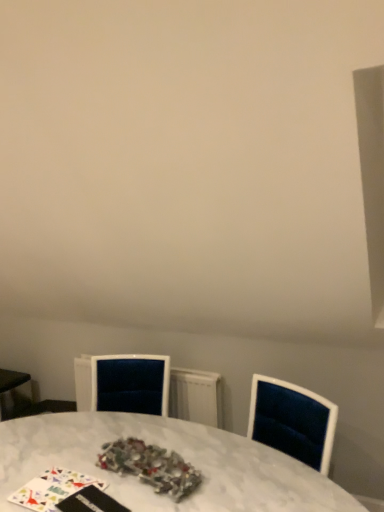
Question: Visually, is velvet radiator at center positioned to the left or to the right of shiny metallic tinsel at center?

Choices:
 (A) left
 (B) right

Answer: (A)

Question: In terms of height, does velvet radiator at center look taller or shorter compared to shiny metallic tinsel at center?

Choices:
 (A) tall
 (B) short

Answer: (A)

Question: Which is nearer to the velvet radiator at center?

Choices:
 (A) shiny metallic tinsel at center
 (B) white marble table at center

Answer: (B)

Question: Estimate the real-world distances between objects in this image. Which object is closer to the white marble table at center?

Choices:
 (A) shiny metallic tinsel at center
 (B) velvet radiator at center

Answer: (A)